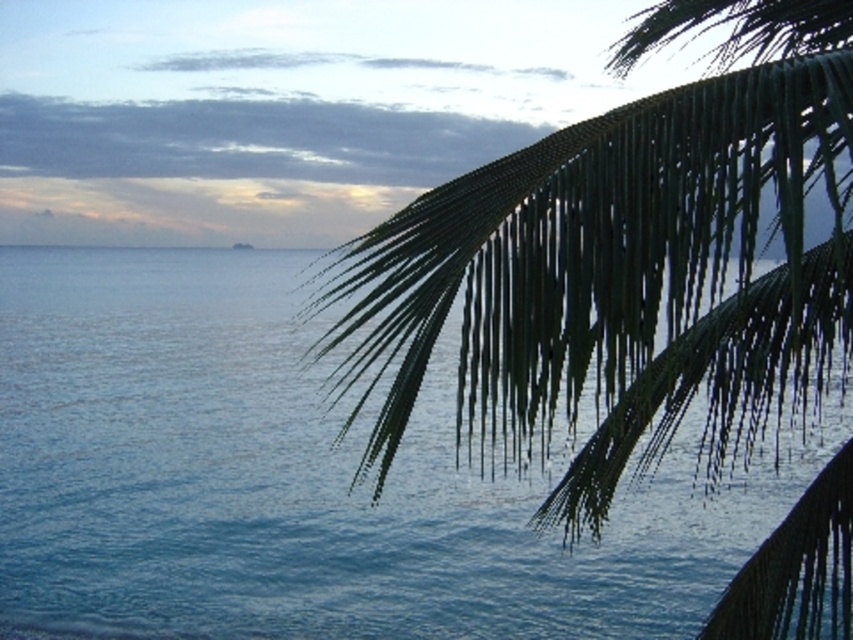
You are a photographer trying to capture the blue water at center and the green leafy palm at upper right in a single frame. Based on their positions, which object would appear larger in the photo?

The blue water at center appears larger in the photo because it is wider than the green leafy palm at upper right.

You are standing at the point closest to the viewer in the image. Which of the two points, point (134, 416) or point (851, 180), is farther away from you?

Point (134, 416) is behind point (851, 180), so it is farther away from you.

You are standing at the point marked as point (300, 481) in the coastal scene. What is located at that exact point?

The blue water at center is located at point (300, 481).